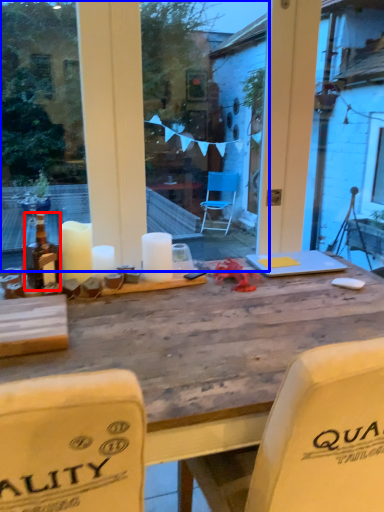
Question: Which point is further to the camera, bottle (highlighted by a red box) or glass window (highlighted by a blue box)?

Choices:
 (A) bottle
 (B) glass window

Answer: (B)